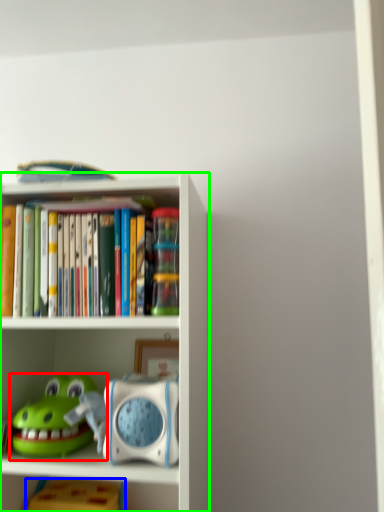
Question: Which is farther away from toy (highlighted by a red box)? toy (highlighted by a blue box) or shelf (highlighted by a green box)?

Choices:
 (A) toy
 (B) shelf

Answer: (A)